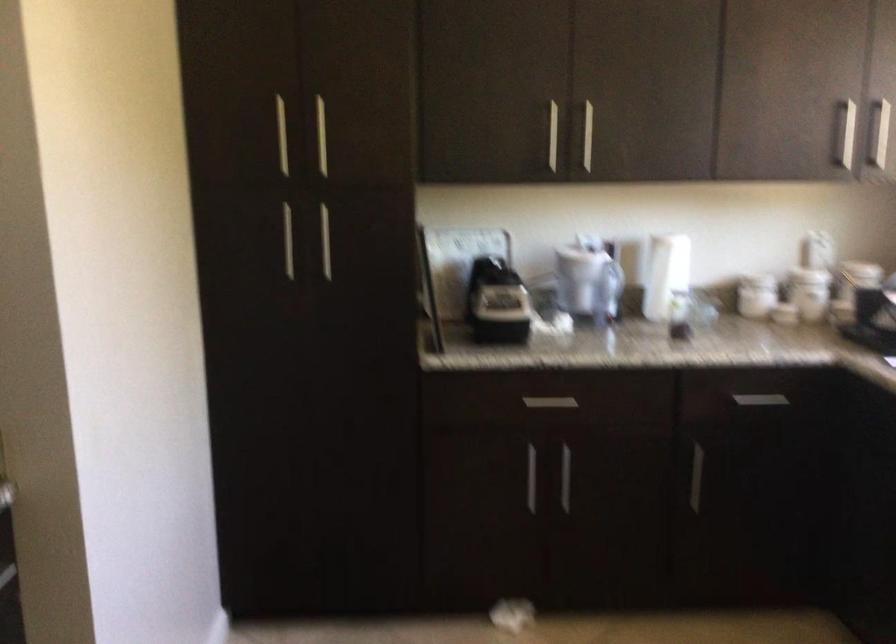
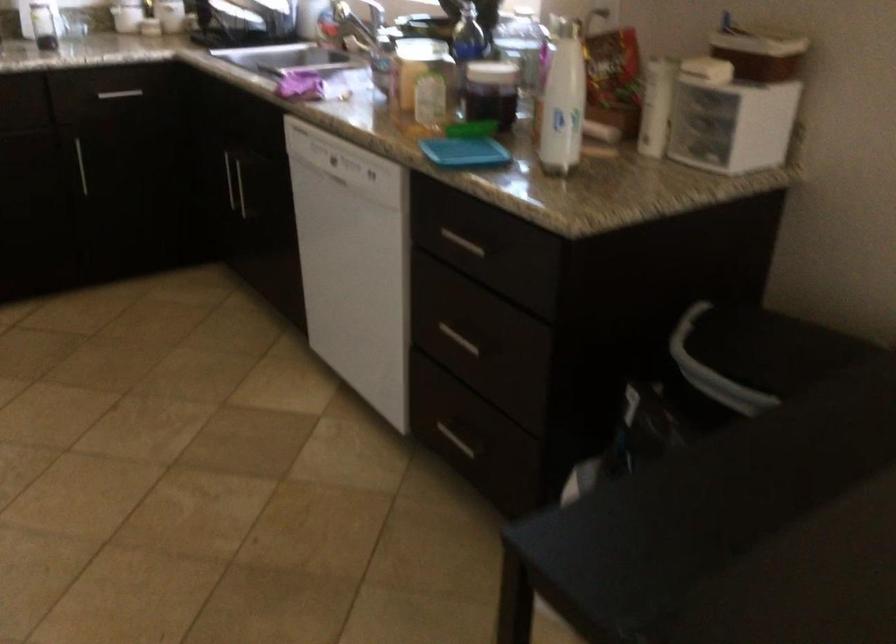
Locate, in the second image, the point that corresponds to [759,399] in the first image.

(119, 93)